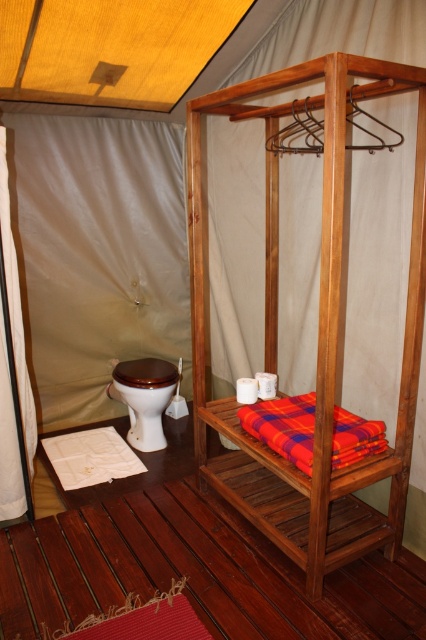
Question: Which of the following is the closest to the observer?

Choices:
 (A) (20, 480)
 (B) (348, 428)
 (C) (146, 412)

Answer: (B)

Question: Is white fabric curtain at left smaller than brown glossy toilet bowl at lower left?

Choices:
 (A) yes
 (B) no

Answer: (A)

Question: Which point appears closest to the camera in this image?

Choices:
 (A) (115, 392)
 (B) (245, 428)
 (C) (5, 212)

Answer: (C)

Question: Which of these objects is positioned farthest from the brown glossy toilet bowl at lower left?

Choices:
 (A) plaid fabric blanket at center
 (B) white fabric curtain at left

Answer: (A)

Question: Is white fabric curtain at left closer to camera compared to brown glossy toilet bowl at lower left?

Choices:
 (A) no
 (B) yes

Answer: (B)

Question: Can you confirm if white fabric curtain at left is positioned above brown glossy toilet bowl at lower left?

Choices:
 (A) no
 (B) yes

Answer: (B)